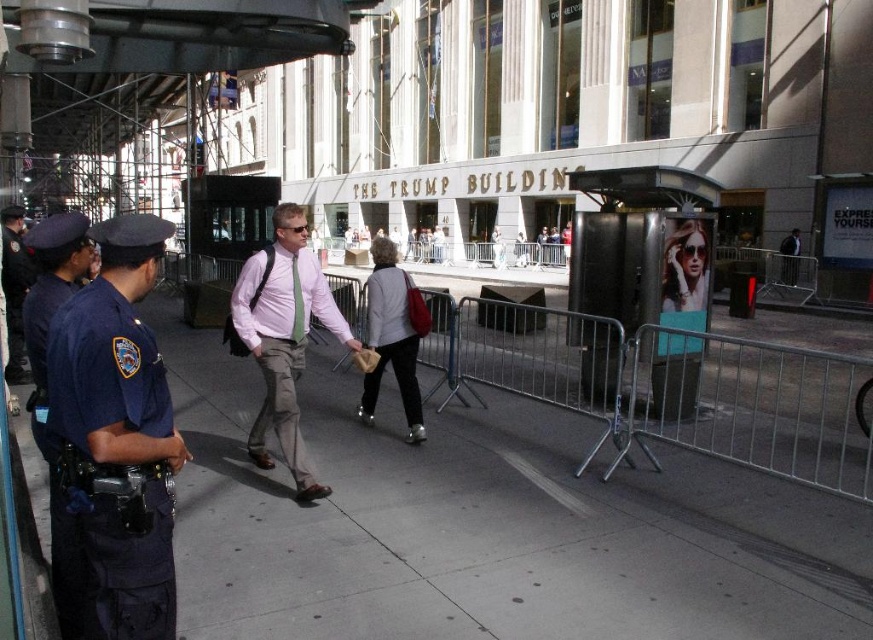
What is located at the point with coordinates (486, 525) in the image?

The point at coordinates (486, 525) indicates the gray concrete sidewalk at center.

You are a photographer trying to capture a clear shot of the pink fabric shirt at center without the metallic silver barrier at center obstructing the view. Given the sizes of the objects, is this possible?

The metallic silver barrier at center is wider than the pink fabric shirt at center, so it might obstruct the view depending on the angle and distance. To capture the shirt without obstruction, position yourself where the barrier doesn